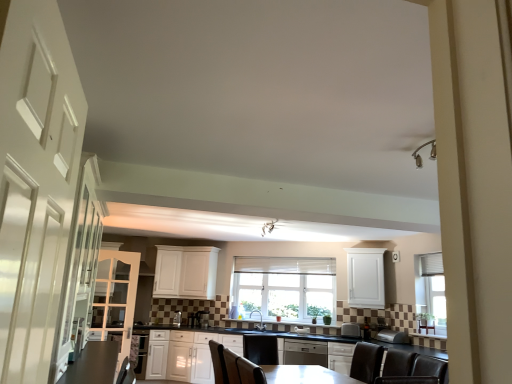
Question: Should I look upward or downward to see white glossy cabinets at center, the third cabinetry from the right?

Choices:
 (A) up
 (B) down

Answer: (B)

Question: Is satin black dishwasher at center at the right side of satin nickel faucet at center?

Choices:
 (A) no
 (B) yes

Answer: (B)

Question: Is the position of satin black dishwasher at center less distant than that of satin nickel faucet at center?

Choices:
 (A) yes
 (B) no

Answer: (A)

Question: Considering the relative positions of satin black dishwasher at center and satin nickel faucet at center in the image provided, is satin black dishwasher at center behind satin nickel faucet at center?

Choices:
 (A) yes
 (B) no

Answer: (B)

Question: Is satin black dishwasher at center to the left of satin nickel faucet at center from the viewer's perspective?

Choices:
 (A) no
 (B) yes

Answer: (A)

Question: Can you confirm if satin black dishwasher at center is bigger than satin nickel faucet at center?

Choices:
 (A) no
 (B) yes

Answer: (B)

Question: From a real-world perspective, is satin black dishwasher at center positioned over satin nickel faucet at center based on gravity?

Choices:
 (A) no
 (B) yes

Answer: (A)

Question: Does satin black dishwasher at center have a lesser height compared to white textured window at center?

Choices:
 (A) yes
 (B) no

Answer: (A)

Question: Is satin black dishwasher at center far away from white textured window at center?

Choices:
 (A) no
 (B) yes

Answer: (B)

Question: Is satin black dishwasher at center wider than white textured window at center?

Choices:
 (A) no
 (B) yes

Answer: (B)

Question: From a real-world perspective, is satin black dishwasher at center on white textured window at center?

Choices:
 (A) no
 (B) yes

Answer: (A)

Question: Can you see satin black dishwasher at center touching white textured window at center?

Choices:
 (A) no
 (B) yes

Answer: (A)

Question: Considering the relative sizes of satin black dishwasher at center and white textured window at center in the image provided, is satin black dishwasher at center smaller than white textured window at center?

Choices:
 (A) no
 (B) yes

Answer: (A)

Question: Can you confirm if white glossy cabinets at center, the third cabinetry from the right, is taller than satin silver toaster at lower center, the 2th appliance viewed from the front?

Choices:
 (A) no
 (B) yes

Answer: (B)